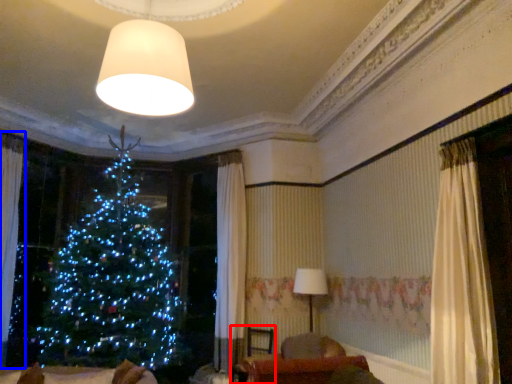
Question: Which object appears closest to the camera in this image, armchair (highlighted by a red box) or curtain (highlighted by a blue box)?

Choices:
 (A) armchair
 (B) curtain

Answer: (B)